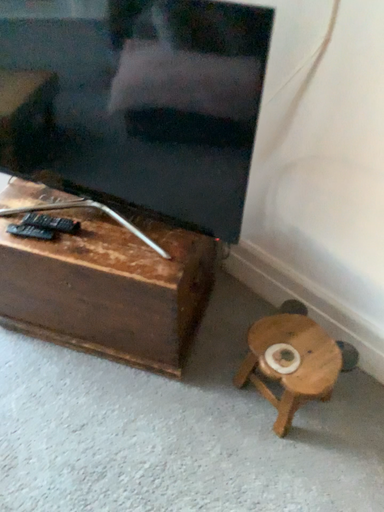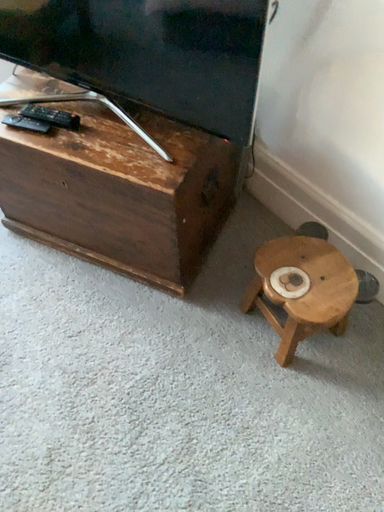
Question: How did the camera likely rotate when shooting the video?

Choices:
 (A) rotated downward
 (B) rotated upward

Answer: (A)